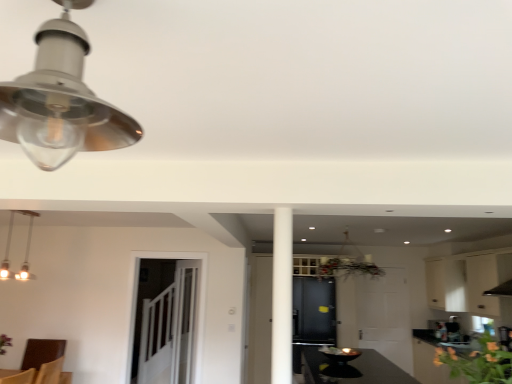
Identify the location of free spot above matte silver lampshade at upper left, the 2th lamp positioned from the left (from a real-world perspective). (90, 13).